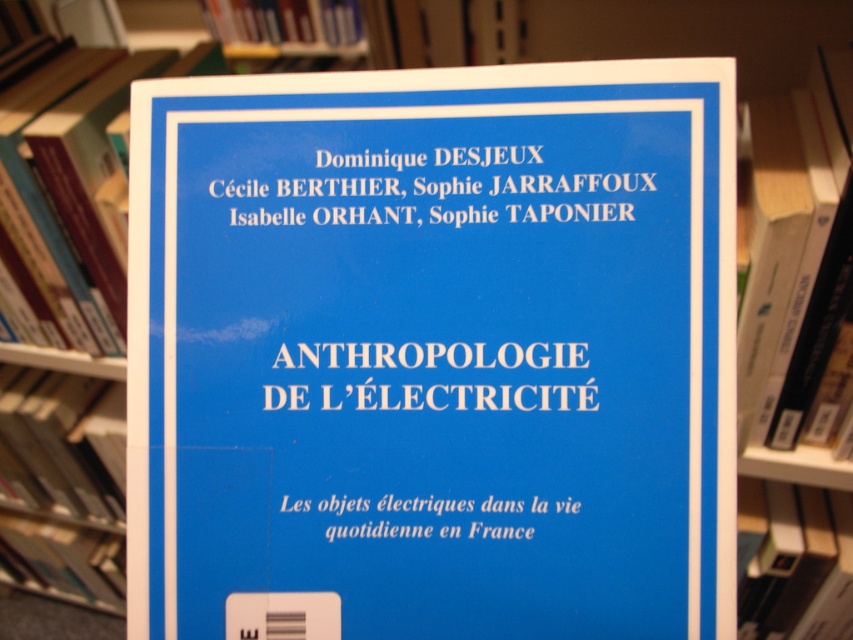
Question: Does blue hardcover book at center have a greater width compared to blue hardcover book at upper center?

Choices:
 (A) no
 (B) yes

Answer: (A)

Question: Considering the real-world distances, which object is closest to the blue hardcover book at upper center?

Choices:
 (A) hardcover book at center
 (B) white matte text at center

Answer: (A)

Question: Which object is the closest to the hardcover book at center?

Choices:
 (A) white paper at center
 (B) white matte text at center
 (C) white text at upper center

Answer: (C)

Question: Can you confirm if blue hardcover book at upper center is wider than white paper at center?

Choices:
 (A) no
 (B) yes

Answer: (B)

Question: Which object appears closest to the camera in this image?

Choices:
 (A) white paper at center
 (B) blue matte book at left

Answer: (A)

Question: Can you confirm if blue paper at center is positioned to the left of hardcover book at center?

Choices:
 (A) no
 (B) yes

Answer: (B)